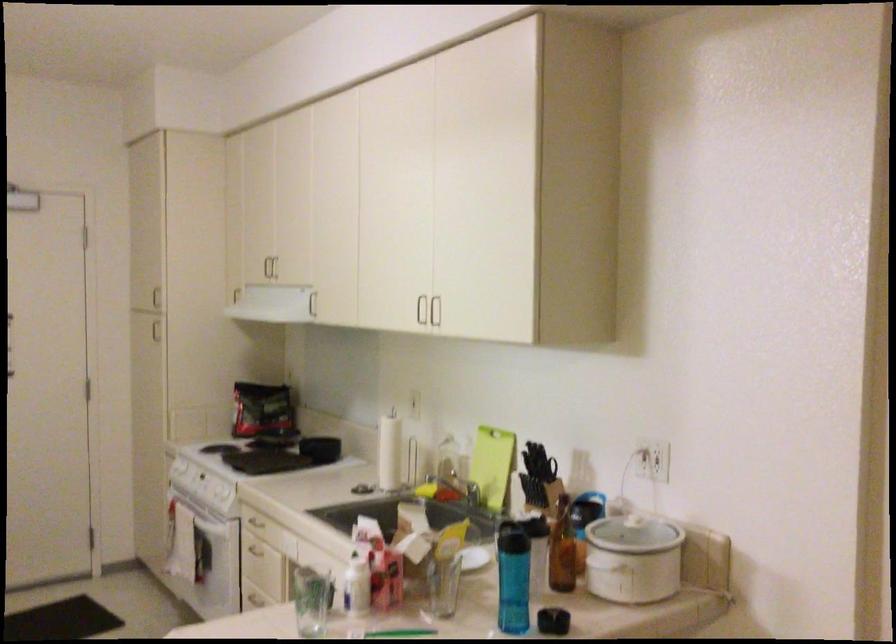
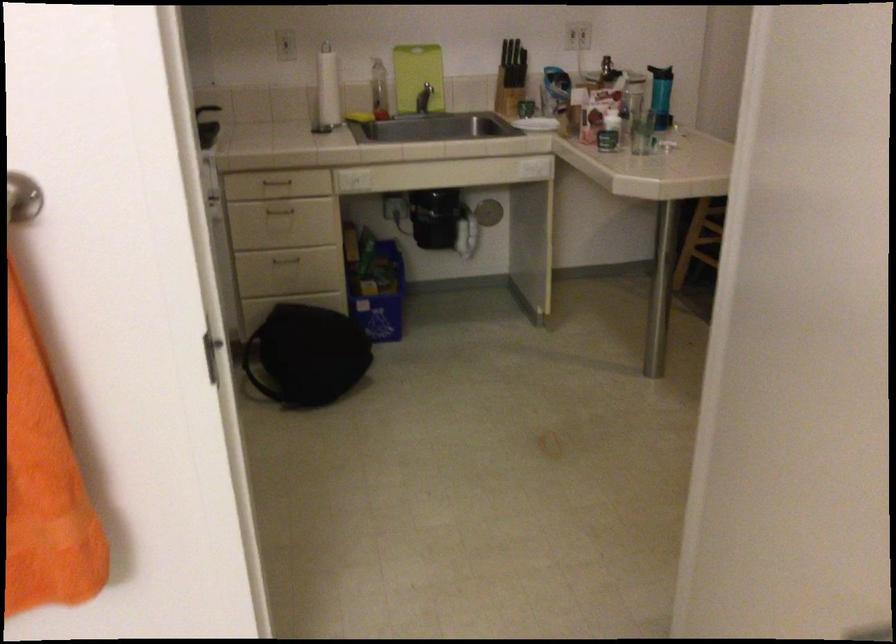
The point at (470, 491) is marked in the first image. Where is the corresponding point in the second image?

(424, 98)